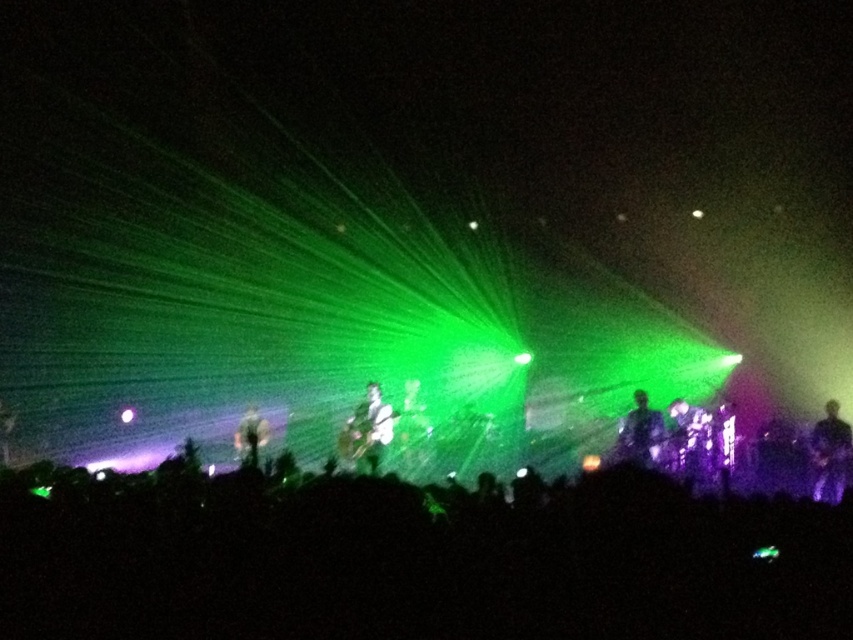
You are a photographer at the concert and want to capture a photo where the black matte crowd at lower center and the shiny black guitar at center are both visible. Based on their positions, which object would appear closer to the bottom of the photo?

The shiny black guitar at center is located below the black matte crowd at lower center, so it would appear closer to the bottom of the photo.

Consider the image. You are standing at the back of the concert venue and want to move closer to the black matte crowd at lower center. If you are 1.8 meters tall, will you be able to see the stage over the crowd?

The black matte crowd at lower center is 3.75 meters away from you. Since the crowd is described as a matte crowd, it is likely that they are stationary and not obstructing your view. Therefore, you should be able to see the stage over the crowd as long as there is no physical obstruction between you and the stage.